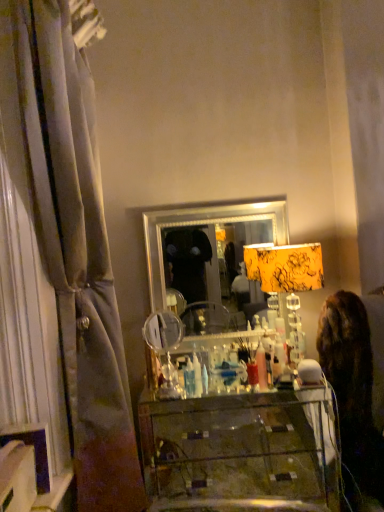
Question: Is silver/metallic mirror at center placed right next to transparent glass vanity at center?

Choices:
 (A) yes
 (B) no

Answer: (B)

Question: Is silver/metallic mirror at center shorter than transparent glass vanity at center?

Choices:
 (A) no
 (B) yes

Answer: (A)

Question: Is silver/metallic mirror at center positioned in front of transparent glass vanity at center?

Choices:
 (A) yes
 (B) no

Answer: (B)

Question: Considering the relative sizes of silver/metallic mirror at center and transparent glass vanity at center in the image provided, is silver/metallic mirror at center bigger than transparent glass vanity at center?

Choices:
 (A) no
 (B) yes

Answer: (A)

Question: Can you confirm if silver/metallic mirror at center is positioned to the left of transparent glass vanity at center?

Choices:
 (A) no
 (B) yes

Answer: (B)

Question: Is transparent glass vanity at center surrounded by silver/metallic mirror at center?

Choices:
 (A) yes
 (B) no

Answer: (B)

Question: Can you confirm if silky gray curtain at left is shorter than yellow floral fabric lampshade at center?

Choices:
 (A) yes
 (B) no

Answer: (B)

Question: From the image's perspective, is silky gray curtain at left under yellow floral fabric lampshade at center?

Choices:
 (A) yes
 (B) no

Answer: (B)

Question: Is silky gray curtain at left next to yellow floral fabric lampshade at center?

Choices:
 (A) no
 (B) yes

Answer: (A)

Question: Considering the relative sizes of silky gray curtain at left and yellow floral fabric lampshade at center in the image provided, is silky gray curtain at left smaller than yellow floral fabric lampshade at center?

Choices:
 (A) yes
 (B) no

Answer: (B)

Question: Is silky gray curtain at left looking in the opposite direction of yellow floral fabric lampshade at center?

Choices:
 (A) no
 (B) yes

Answer: (A)

Question: Does silky gray curtain at left have a larger size compared to yellow floral fabric lampshade at center?

Choices:
 (A) no
 (B) yes

Answer: (B)

Question: From the image's perspective, is yellow floral fabric lampshade at center beneath silver/metallic mirror at center?

Choices:
 (A) no
 (B) yes

Answer: (B)